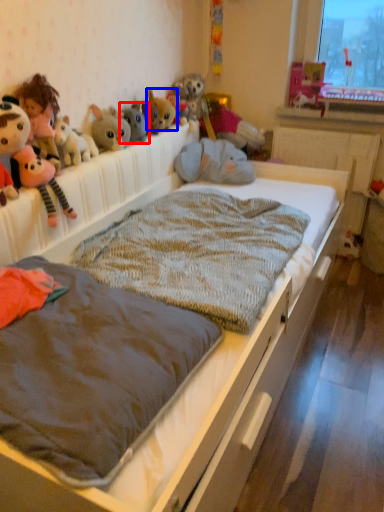
Question: Among these objects, which one is farthest to the camera, toy (highlighted by a red box) or toy (highlighted by a blue box)?

Choices:
 (A) toy
 (B) toy

Answer: (B)